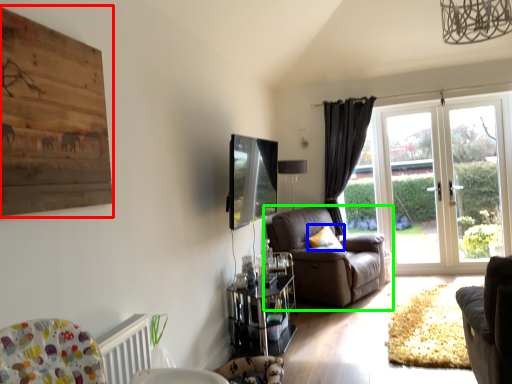
Question: Which object is positioned farthest from picture frame (highlighted by a red box)? Select from pillow (highlighted by a blue box) and chair (highlighted by a green box).

Choices:
 (A) pillow
 (B) chair

Answer: (A)